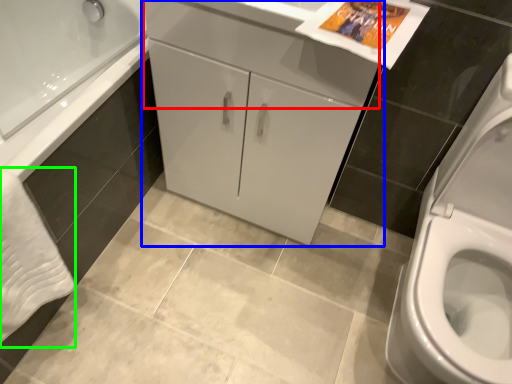
Question: Which object is positioned farthest from drawer (highlighted by a red box)? Select from bathroom cabinet (highlighted by a blue box) and bath towel (highlighted by a green box).

Choices:
 (A) bathroom cabinet
 (B) bath towel

Answer: (B)